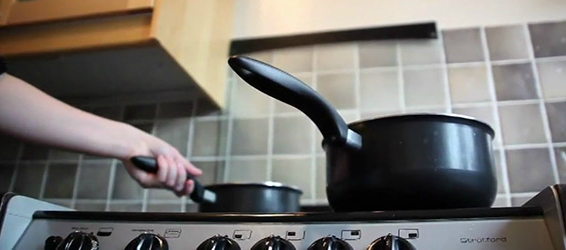
This screenshot has width=566, height=250. What are the coordinates of `handle of the pans` in the screenshot? It's located at (268, 66), (145, 155).